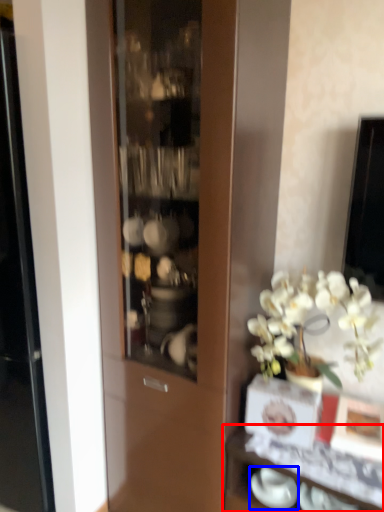
Question: Which of the following is the closest to the observer, shelf (highlighted by a red box) or tableware (highlighted by a blue box)?

Choices:
 (A) shelf
 (B) tableware

Answer: (A)